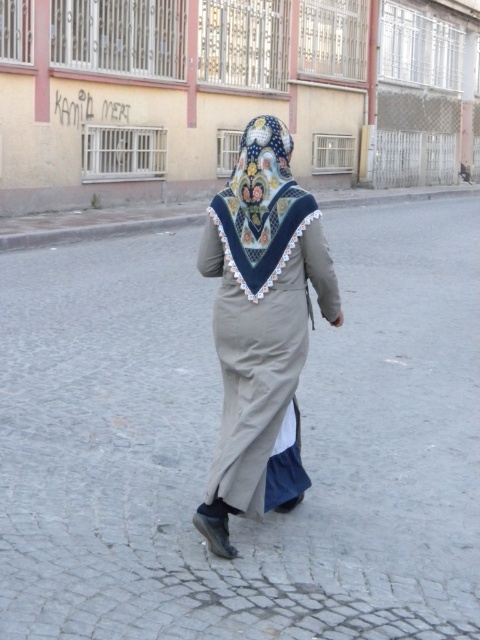
Question: Does beige cotton robe at center appear over embroidered silk headscarf at center?

Choices:
 (A) no
 (B) yes

Answer: (A)

Question: Considering the relative positions of beige cotton robe at center and embroidered silk headscarf at center in the image provided, where is beige cotton robe at center located with respect to embroidered silk headscarf at center?

Choices:
 (A) left
 (B) right

Answer: (A)

Question: Can you confirm if beige cotton robe at center is thinner than embroidered silk headscarf at center?

Choices:
 (A) yes
 (B) no

Answer: (B)